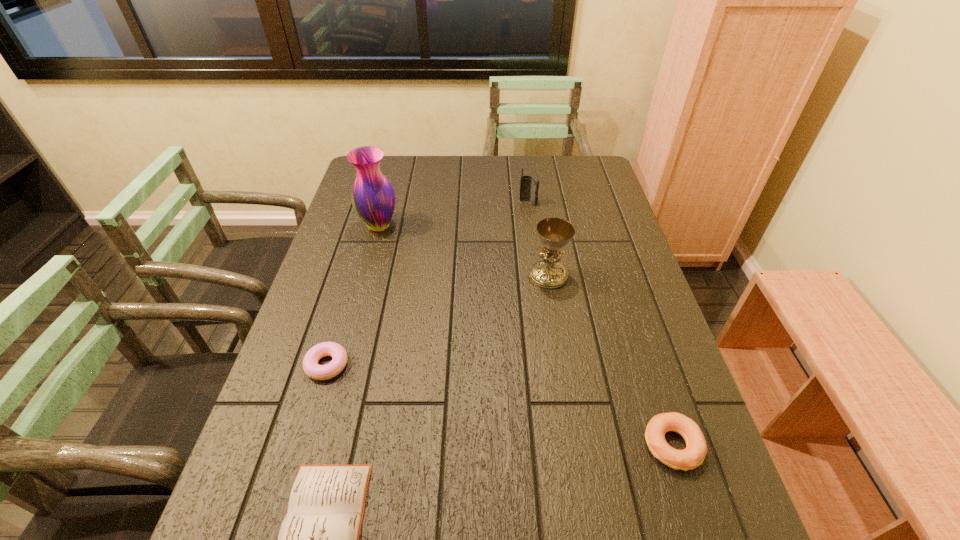
Where is `vacant area at the right edge of the desktop`? Image resolution: width=960 pixels, height=540 pixels. vacant area at the right edge of the desktop is located at coordinates 639,493.

In the image, there is a desktop. Where is `free space at the far right corner`? This screenshot has width=960, height=540. free space at the far right corner is located at coordinates (584, 161).

You are a GUI agent. You are given a task and a screenshot of the screen. Output one action in this format:
    pyautogui.click(x=<x>, y=<y>)
    Task: Click on the free point between the fourth shortest object and the third nearest object
    
    Given the screenshot: What is the action you would take?
    pyautogui.click(x=427, y=284)

Locate an element on the screen. The image size is (960, 540). vacant area that lies between the fifth shortest object and the tallest object is located at coordinates (464, 251).

Find the location of a particular element. Image resolution: width=960 pixels, height=540 pixels. free spot between the chalice and the vase is located at coordinates (464, 251).

Locate an element on the screen. The height and width of the screenshot is (540, 960). vacant space in between the second shortest object and the tallest object is located at coordinates (353, 295).

Find the location of a particular element. blank region between the fourth nearest object and the fourth shortest object is located at coordinates (539, 239).

Where is `unoccupied position between the fifth nearest object and the fourth shortest object`? Image resolution: width=960 pixels, height=540 pixels. unoccupied position between the fifth nearest object and the fourth shortest object is located at coordinates (454, 214).

Find the location of a particular element. vacant space in between the rightmost object and the fourth farthest object is located at coordinates (500, 405).

Identify the location of the third closest object to the bagel. (311, 367).